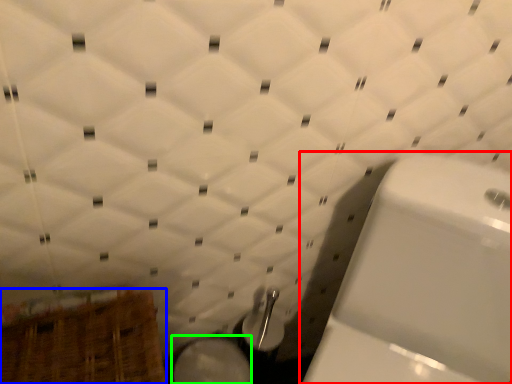
Question: Estimate the real-world distances between objects in this image. Which object is closer to toilet (highlighted by a red box), basket (highlighted by a blue box) or bidet (highlighted by a green box)?

Choices:
 (A) basket
 (B) bidet

Answer: (B)